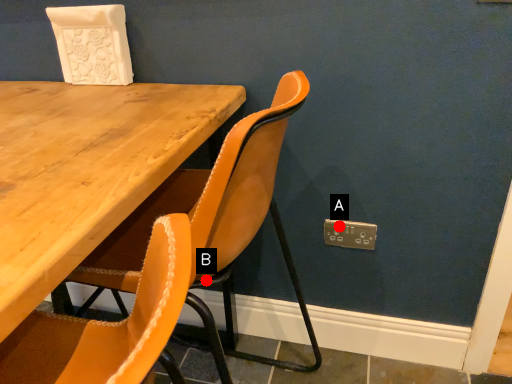
Question: Two points are circled on the image, labeled by A and B beside each circle. Which point appears closest to the camera in this image?

Choices:
 (A) A is closer
 (B) B is closer

Answer: (A)